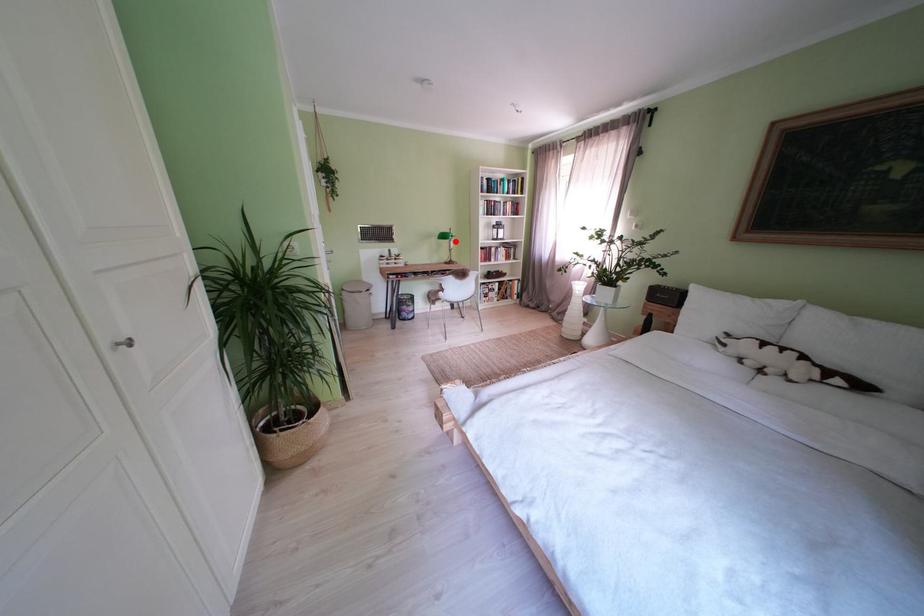
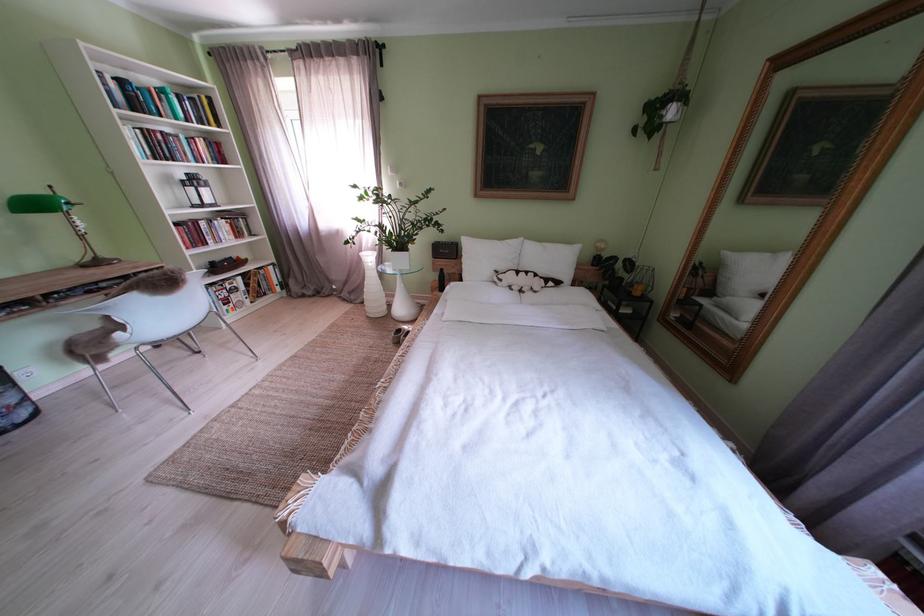
Locate, in the second image, the point that corresponds to the highlighted location in the first image.

(46, 209)